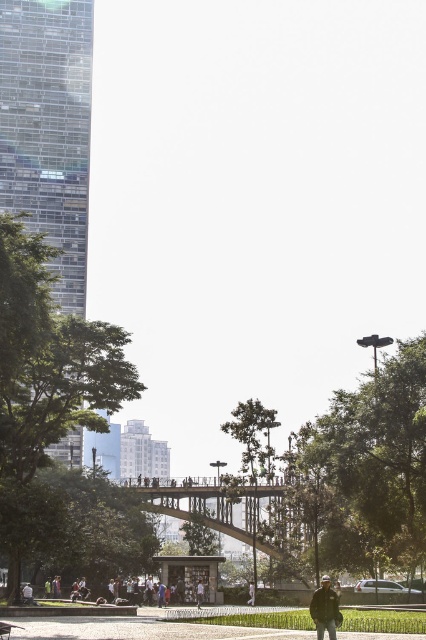
In the urban park scene, there are two people wearing a dark blue jacket at lower center and a white fabric shirt at center. From the perspective of someone standing at the lower edge of the image, which clothing item is positioned to the right?

The dark blue jacket at lower center is positioned to the right of the white fabric shirt at center.

You are standing at the grassy area in the foreground of the urban park scene. You see two points marked as point 1 at coordinates point (322, 602) and point 2 at coordinates point (198, 602). Which point is closer to you?

→ Point (322, 602) is in front of point (198, 602), so point 1 at coordinates point (322, 602) is closer to you.

You are standing at the entrance of the park and see the light brown leather jacket at center. If you walk straight ahead, will you move towards or away from the jacket?

Since the light brown leather jacket at center is located at point coordinates, walking straight ahead from the entrance would move you towards the jacket. The exact direction depends on the park layout, but based on the coordinates, it is positioned centrally, so moving forward aligns with its location.